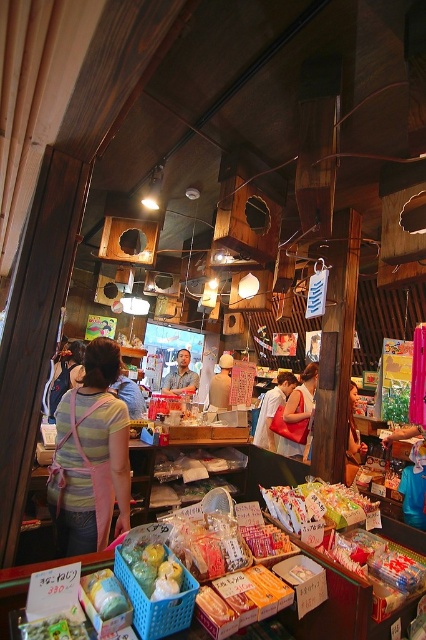
Question: Can you confirm if shiny plastic candy at center is positioned to the left of matte red handbag at center?

Choices:
 (A) no
 (B) yes

Answer: (B)

Question: Which is farther from the matte red bag at center?

Choices:
 (A) pink fabric apron at center
 (B) matte red handbag at center
 (C) translucent plastic bag at center
 (D) shiny plastic candy at center

Answer: (C)

Question: Which object is the closest to the pink fabric apron at center?

Choices:
 (A) shiny plastic candy at center
 (B) matte red bag at center
 (C) translucent plastic bag at center
 (D) matte red handbag at center

Answer: (C)

Question: Which point is closer to the camera?

Choices:
 (A) matte red bag at center
 (B) matte red handbag at center
 (C) pink fabric apron at center
 (D) shiny plastic candy at center

Answer: (D)

Question: Observing the image, what is the correct spatial positioning of pink fabric apron at center in reference to shiny plastic candy at center?

Choices:
 (A) below
 (B) above

Answer: (B)

Question: Can you confirm if matte red handbag at center is thinner than matte red bag at center?

Choices:
 (A) no
 (B) yes

Answer: (B)